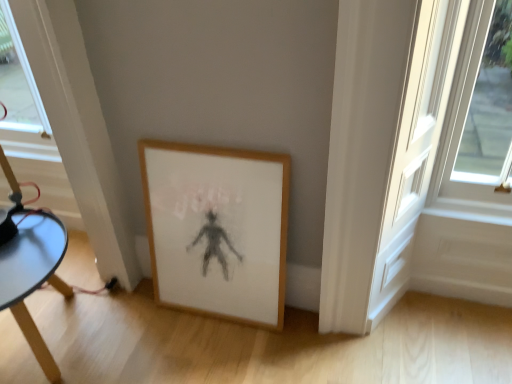
Question: Is wooden table at lower left bigger or smaller than wooden picture frame at lower center?

Choices:
 (A) big
 (B) small

Answer: (A)

Question: Is point click(49, 370) closer or farther from the camera than point click(207, 170)?

Choices:
 (A) farther
 (B) closer

Answer: (A)

Question: Looking at their shapes, would you say wooden table at lower left is wider or thinner than wooden picture frame at lower center?

Choices:
 (A) thin
 (B) wide

Answer: (B)

Question: Is wooden picture frame at lower center taller or shorter than wooden table at lower left?

Choices:
 (A) short
 (B) tall

Answer: (B)

Question: Would you say wooden picture frame at lower center is inside or outside wooden table at lower left?

Choices:
 (A) inside
 (B) outside

Answer: (B)

Question: Is wooden picture frame at lower center wider or thinner than wooden table at lower left?

Choices:
 (A) thin
 (B) wide

Answer: (A)

Question: Considering their positions, is wooden picture frame at lower center located in front of or behind wooden table at lower left?

Choices:
 (A) front
 (B) behind

Answer: (B)